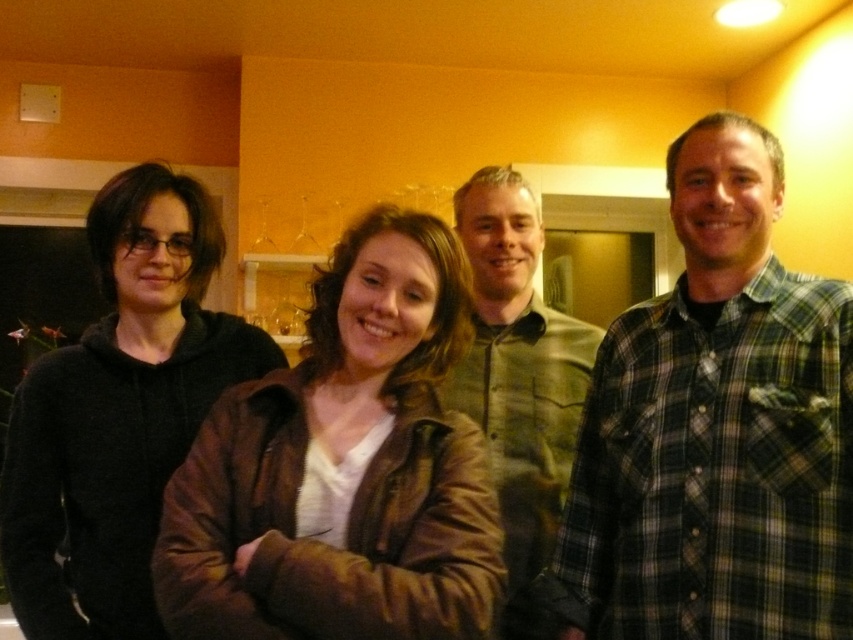
Does brown leather jacket at center appear on the right side of black hoodie at left?

Correct, you'll find brown leather jacket at center to the right of black hoodie at left.

Can you confirm if brown leather jacket at center is smaller than black hoodie at left?

Indeed, brown leather jacket at center has a smaller size compared to black hoodie at left.

The width and height of the screenshot is (853, 640). What are the coordinates of `brown leather jacket at center` in the screenshot? It's located at (341, 467).

At what (x,y) coordinates should I click in order to perform the action: click on brown leather jacket at center. Please return your answer as a coordinate pair (x, y). The height and width of the screenshot is (640, 853). Looking at the image, I should click on (341, 467).

Is point (724, 234) in front of point (546, 429)?

Yes, point (724, 234) is in front of point (546, 429).

Is plaid flannel shirt at right further to the viewer compared to green plaid shirt at center?

No, it is not.

Which is in front, point (679, 355) or point (489, 372)?

Point (679, 355) is more forward.

Locate an element on the screen. plaid flannel shirt at right is located at coordinates (x=717, y=428).

Who is more distant from viewer, (239, 365) or (577, 358)?

The point (577, 358) is behind.

Between point (76, 545) and point (532, 296), which one is positioned in front?

Point (76, 545) is in front.

This screenshot has width=853, height=640. Identify the location of black hoodie at left. (119, 412).